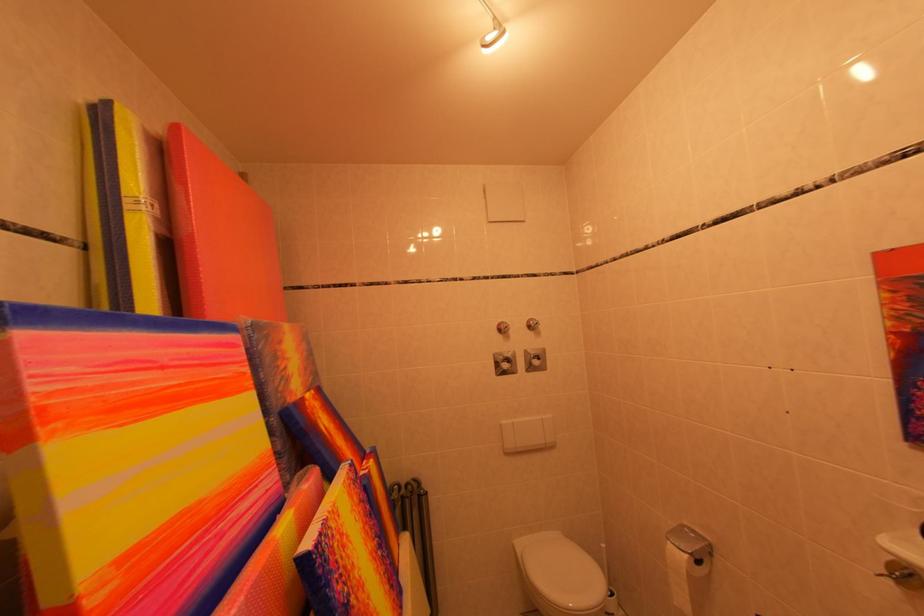
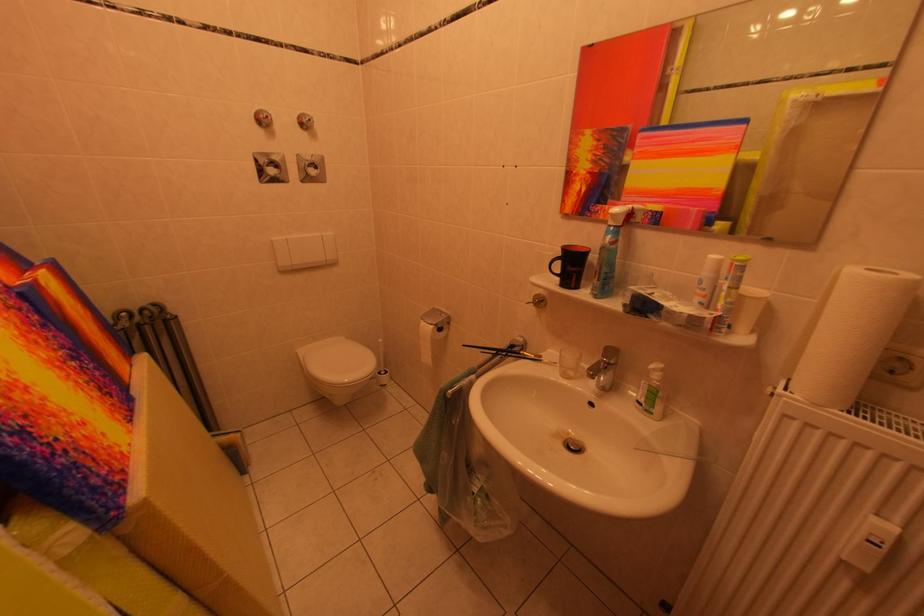
Find the pixel in the second image that matches the point at 512,331 in the first image.

(271, 120)